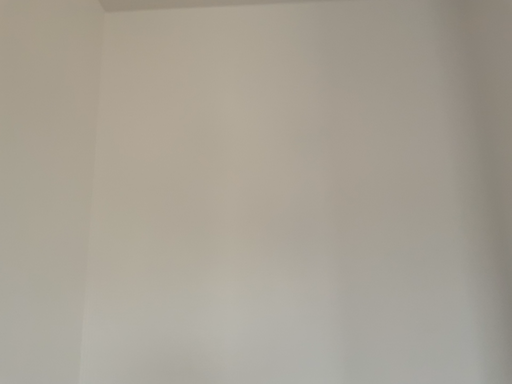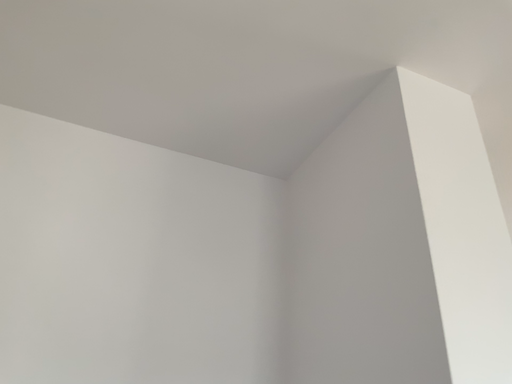
Question: How did the camera likely rotate when shooting the video?

Choices:
 (A) rotated downward
 (B) rotated upward

Answer: (B)